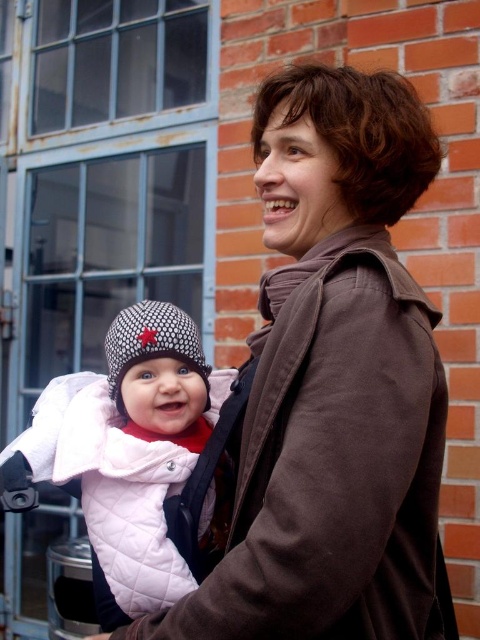
You are a fashion designer observing the scene. You need to determine which item of clothing has a greater width for a new collection. Which one is wider between the brown suede coat at center and the white quilted jacket at center?

The brown suede coat at center has a larger width than the white quilted jacket at center according to the description.

You are a photographer trying to capture the baby in the carrier. The baby is wearing a white quilted jacket at center and a knitted woolen hat at center. Which item is positioned lower on the baby?

The white quilted jacket at center is positioned lower than the knitted woolen hat at center on the baby.

You are a photographer trying to capture the perfect shot of the scene. You want to focus on the brown suede coat at center. Where should you aim your camera to ensure the coat is centered in the frame?

You should aim your camera at the coordinates point (333, 381) to center the brown suede coat at center in the frame.